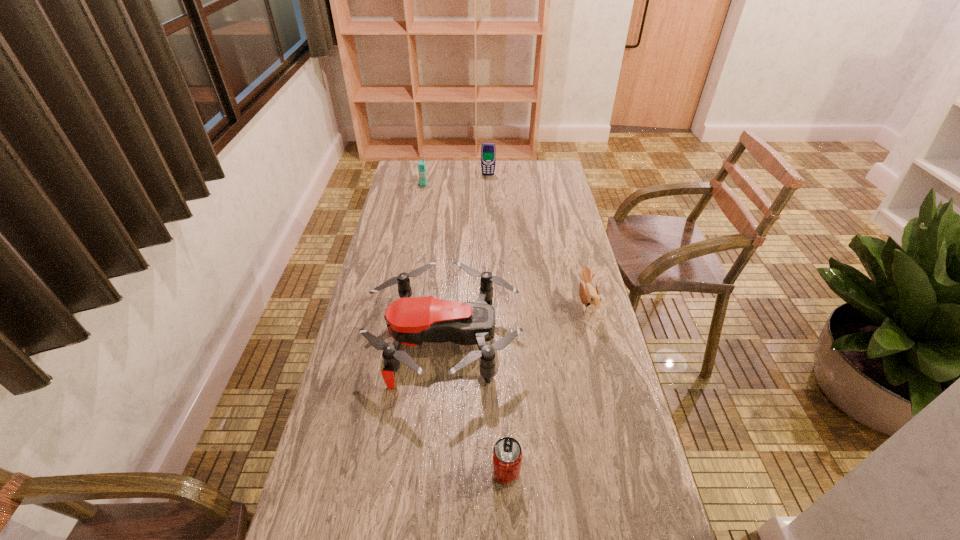
Where is `free location located 0.280m on the left of the pop soda`? This screenshot has height=540, width=960. free location located 0.280m on the left of the pop soda is located at coordinates (374, 473).

Where is `vacant space situated 0.310m at the beak of the rightmost object`? Image resolution: width=960 pixels, height=540 pixels. vacant space situated 0.310m at the beak of the rightmost object is located at coordinates (484, 306).

Locate an element on the screen. This screenshot has width=960, height=540. vacant space located at the beak of the rightmost object is located at coordinates (457, 306).

Where is `vacant space located 0.330m at the beak of the rightmost object`? vacant space located 0.330m at the beak of the rightmost object is located at coordinates (478, 306).

In order to click on cellular telephone positioned at the left edge in this screenshot , I will do `click(421, 164)`.

Locate an element on the screen. Image resolution: width=960 pixels, height=540 pixels. drone that is at the left edge is located at coordinates (410, 321).

The height and width of the screenshot is (540, 960). I want to click on object present at the right edge, so click(x=590, y=297).

Where is `object that is at the far left corner`? object that is at the far left corner is located at coordinates (421, 164).

The width and height of the screenshot is (960, 540). In the image, there is a desktop. What are the coordinates of `vacant space at the far edge` in the screenshot? It's located at (477, 171).

The width and height of the screenshot is (960, 540). Find the location of `vacant region at the left edge of the desktop`. vacant region at the left edge of the desktop is located at coordinates (413, 225).